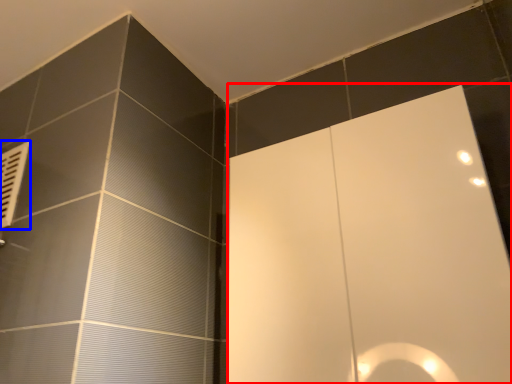
Question: Which object is further to the camera taking this photo, screen door (highlighted by a red box) or air conditioner (highlighted by a blue box)?

Choices:
 (A) screen door
 (B) air conditioner

Answer: (B)